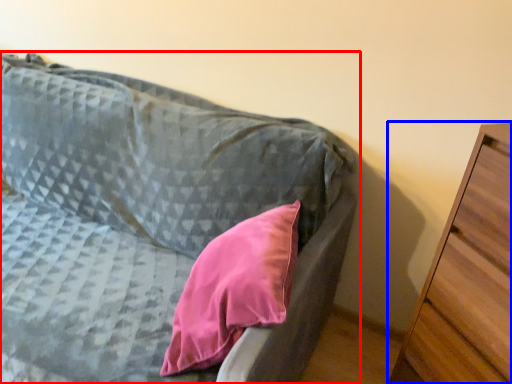
Question: Which of the following is the farthest to the observer, furniture (highlighted by a red box) or chest of drawers (highlighted by a blue box)?

Choices:
 (A) furniture
 (B) chest of drawers

Answer: (B)